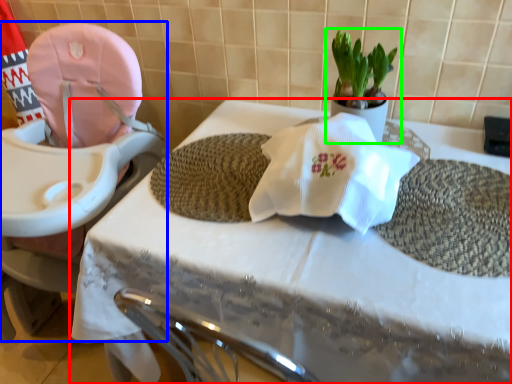
Question: Considering the real-world distances, which object is closest to table (highlighted by a red box)? baby carriage (highlighted by a blue box) or houseplant (highlighted by a green box).

Choices:
 (A) baby carriage
 (B) houseplant

Answer: (A)